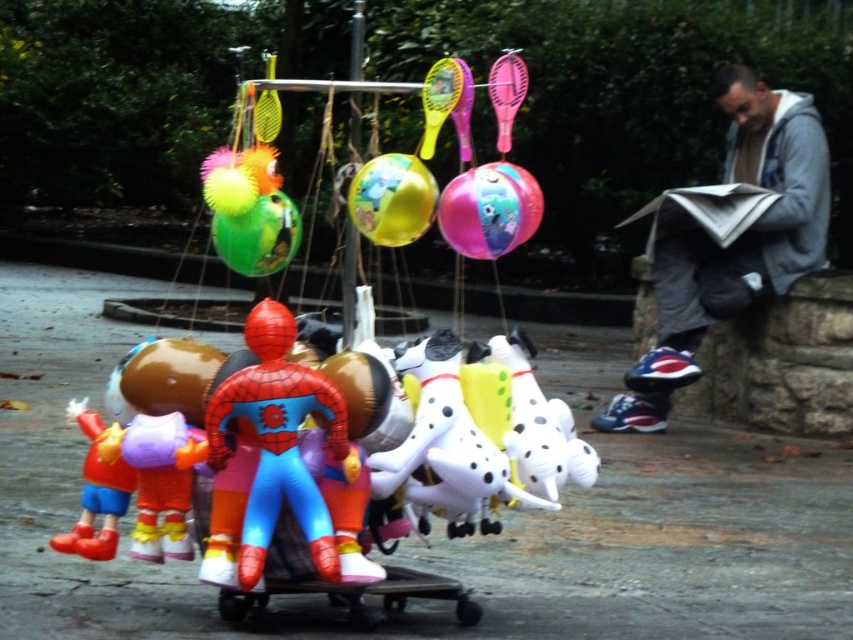
Looking at this image, does rubber clown at center have a lesser height compared to translucent green balloon at center?

In fact, rubber clown at center may be taller than translucent green balloon at center.

Where is `rubber clown at center`? The image size is (853, 640). rubber clown at center is located at coordinates (96, 493).

Measure the distance between rubber clown at center and camera.

rubber clown at center is 3.48 meters from camera.

You are a GUI agent. You are given a task and a screenshot of the screen. Output one action in this format:
    pyautogui.click(x=<x>, y=<y>)
    Task: Click on the rubber clown at center
    
    Given the screenshot: What is the action you would take?
    pyautogui.click(x=96, y=493)

Between shiny metallic balloon at center and rubber clown at center, which one is positioned higher?

shiny metallic balloon at center is above.

Consider the image. Can you confirm if shiny metallic balloon at center is bigger than rubber clown at center?

No, shiny metallic balloon at center is not bigger than rubber clown at center.

Identify the location of shiny metallic balloon at center. This screenshot has width=853, height=640. (392, 198).

Consider the image. Does gray hoodie at upper right have a larger size compared to rubber clown at center?

Correct, gray hoodie at upper right is larger in size than rubber clown at center.

Does gray hoodie at upper right have a greater height compared to rubber clown at center?

Yes, gray hoodie at upper right is taller than rubber clown at center.

Who is more forward, (709, 291) or (82, 400)?

Point (709, 291)

Image resolution: width=853 pixels, height=640 pixels. I want to click on gray hoodie at upper right, so click(730, 243).